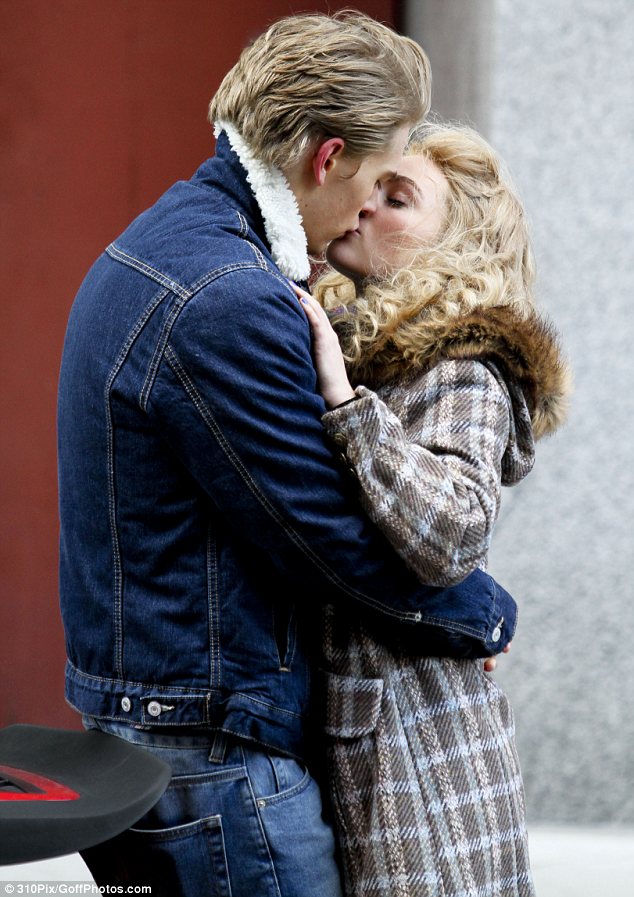
Identify the location of wall. (574, 657).